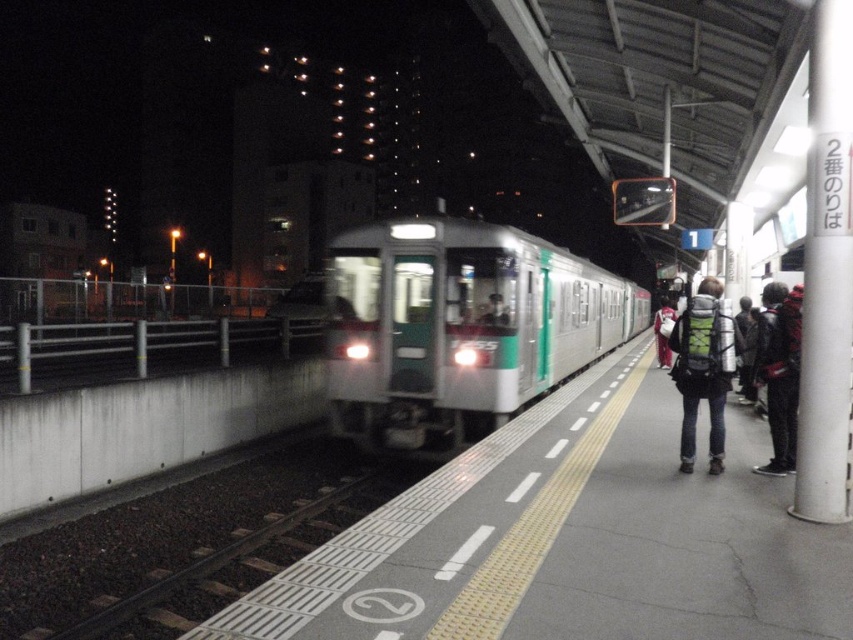
You are standing at the point marked by coordinates point (x=459, y=326). What object are you directly facing?

You are directly facing the green metallic train at center, as the point (x=459, y=326) marks its location.

You are standing on the platform at the train station. There is a point marked at coordinates [459,326]. What object does this point correspond to?

The point at coordinates [459,326] marks the green metallic train at center.